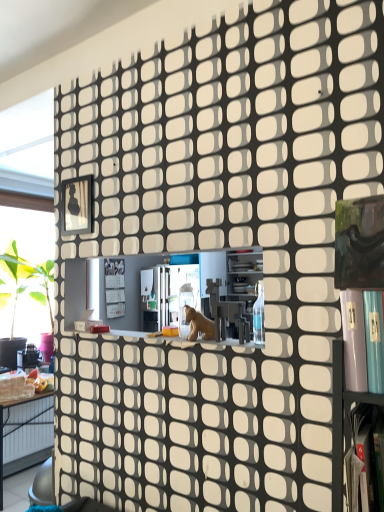
Identify the location of brown matte animal at center. This screenshot has width=384, height=512. (199, 325).

How different are the orientations of metallic silver shelf at lower right and brown matte animal at center in degrees?

metallic silver shelf at lower right and brown matte animal at center are facing 0.0845 degrees away from each other.

Could brown matte animal at center be considered to be inside metallic silver shelf at lower right?

That's incorrect, brown matte animal at center is not inside metallic silver shelf at lower right.

Looking at this image, in terms of width, does metallic silver shelf at lower right look wider or thinner when compared to brown matte animal at center?

metallic silver shelf at lower right is wider than brown matte animal at center.

Is metallic silver shelf at lower right positioned with its back to brown matte animal at center?

metallic silver shelf at lower right does not have its back to brown matte animal at center.

From the image's perspective, does metallic silver shelf at lower right appear higher than metallic frame at upper left?

Actually, metallic silver shelf at lower right appears below metallic frame at upper left in the image.

From the picture: In the image, is metallic silver shelf at lower right positioned in front of or behind metallic frame at upper left?

Clearly, metallic silver shelf at lower right is in front of metallic frame at upper left.

Which is farther, (x=336, y=395) or (x=68, y=195)?

The point (x=68, y=195) is behind.

Could you tell me if metallic silver shelf at lower right is turned towards metallic frame at upper left?

No, metallic silver shelf at lower right is not aimed at metallic frame at upper left.

Are metallic frame at upper left and brown matte animal at center located far from each other?

Actually, metallic frame at upper left and brown matte animal at center are a little close together.

What's the angular difference between metallic frame at upper left and brown matte animal at center's facing directions?

They differ by 0.896 degrees in their facing directions.

Does metallic frame at upper left come behind brown matte animal at center?

Yes, it is behind brown matte animal at center.

Considering the relative sizes of metallic frame at upper left and brown matte animal at center in the image provided, is metallic frame at upper left taller than brown matte animal at center?

Indeed, metallic frame at upper left has a greater height compared to brown matte animal at center.

Would you consider brown matte animal at center to be distant from metallic silver shelf at lower right?

No, brown matte animal at center is in close proximity to metallic silver shelf at lower right.

Can you confirm if brown matte animal at center is smaller than metallic silver shelf at lower right?

Yes.

From the image's perspective, is brown matte animal at center beneath metallic silver shelf at lower right?

Actually, brown matte animal at center appears above metallic silver shelf at lower right in the image.

Is brown matte animal at center positioned beyond the bounds of metallic frame at upper left?

Absolutely, brown matte animal at center is external to metallic frame at upper left.

Is brown matte animal at center taller than metallic frame at upper left?

Incorrect, the height of brown matte animal at center is not larger of that of metallic frame at upper left.

Which object is closer to the camera, brown matte animal at center or metallic frame at upper left?

brown matte animal at center is more forward.

Is brown matte animal at center far away from metallic frame at upper left?

No, there isn't a large distance between brown matte animal at center and metallic frame at upper left.

In the scene shown: From the image's perspective, is metallic frame at upper left beneath metallic silver shelf at lower right?

Incorrect, from the image's perspective, metallic frame at upper left is higher than metallic silver shelf at lower right.

Is metallic frame at upper left aimed at metallic silver shelf at lower right?

No, metallic frame at upper left is not aimed at metallic silver shelf at lower right.

Is metallic frame at upper left not close to metallic silver shelf at lower right?

Yes, metallic frame at upper left and metallic silver shelf at lower right are quite far apart.

From a real-world perspective, which is physically below, metallic frame at upper left or metallic silver shelf at lower right?

metallic silver shelf at lower right, from a real-world perspective.

Locate an element on the screen. This screenshot has height=512, width=384. shelf on the right of brown matte animal at center is located at coordinates (342, 419).

Image resolution: width=384 pixels, height=512 pixels. Identify the location of square behind the metallic silver shelf at lower right. (77, 205).

When comparing their distances from metallic silver shelf at lower right, does brown matte animal at center or metallic frame at upper left seem further?

metallic frame at upper left is positioned further to the anchor metallic silver shelf at lower right.

Considering their positions, is metallic silver shelf at lower right positioned closer to metallic frame at upper left than brown matte animal at center?

brown matte animal at center.

From the image, which object appears to be farther from brown matte animal at center, metallic frame at upper left or metallic silver shelf at lower right?

Based on the image, metallic frame at upper left appears to be further to brown matte animal at center.

Estimate the real-world distances between objects in this image. Which object is further from metallic frame at upper left, brown matte animal at center or metallic silver shelf at lower right?

The object further to metallic frame at upper left is metallic silver shelf at lower right.

Estimate the real-world distances between objects in this image. Which object is further from metallic silver shelf at lower right, metallic frame at upper left or brown matte animal at center?

metallic frame at upper left.

Considering their positions, is metallic silver shelf at lower right positioned closer to brown matte animal at center than metallic frame at upper left?

metallic silver shelf at lower right lies closer to brown matte animal at center than the other object.

Where is `animal between metallic silver shelf at lower right and metallic frame at upper left along the z-axis`? animal between metallic silver shelf at lower right and metallic frame at upper left along the z-axis is located at coordinates (199, 325).